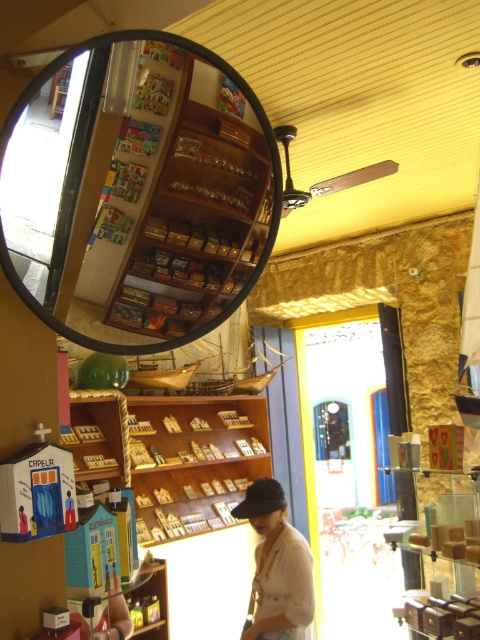
Is white cotton shirt at lower center taller than black fabric baseball cap at center?

Correct, white cotton shirt at lower center is much taller as black fabric baseball cap at center.

Does white cotton shirt at lower center appear on the left side of black fabric baseball cap at center?

Incorrect, white cotton shirt at lower center is not on the left side of black fabric baseball cap at center.

Locate an element on the screen. white cotton shirt at lower center is located at coordinates (276, 566).

Is wooden houses at center below white cotton shirt at lower center?

No, wooden houses at center is not below white cotton shirt at lower center.

Can you confirm if wooden houses at center is taller than white cotton shirt at lower center?

Correct, wooden houses at center is much taller as white cotton shirt at lower center.

The width and height of the screenshot is (480, 640). What do you see at coordinates (173, 456) in the screenshot?
I see `wooden houses at center` at bounding box center [173, 456].

Where is `wooden houses at center`? This screenshot has width=480, height=640. wooden houses at center is located at coordinates (173, 456).

Is point (129, 454) positioned in front of point (267, 512)?

No, (129, 454) is behind (267, 512).

Between wooden houses at center and black fabric baseball cap at center, which one is positioned lower?

black fabric baseball cap at center is lower down.

This screenshot has width=480, height=640. What do you see at coordinates (173, 456) in the screenshot?
I see `wooden houses at center` at bounding box center [173, 456].

Where is `wooden houses at center`? wooden houses at center is located at coordinates (173, 456).